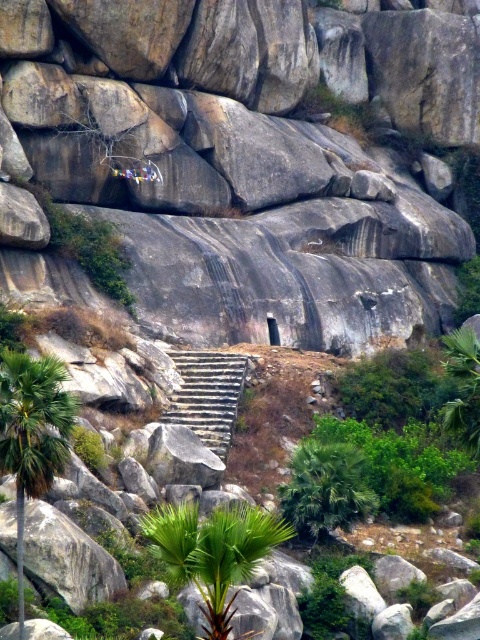
Question: Is green leafy palm at lower center behind green leafy palm tree at lower left?

Choices:
 (A) yes
 (B) no

Answer: (B)

Question: Observing the image, what is the correct spatial positioning of green leafy palm at center in reference to gray stone stairs at center?

Choices:
 (A) below
 (B) above

Answer: (A)

Question: Is green leafy palm tree at lower left bigger than gray stone stairs at center?

Choices:
 (A) yes
 (B) no

Answer: (B)

Question: Which of these objects is positioned closest to the green leafy palm at lower center?

Choices:
 (A) gray stone stairs at center
 (B) green leafy palm tree at lower left
 (C) green leafy palm at center

Answer: (B)

Question: Which object appears farthest from the camera in this image?

Choices:
 (A) green leafy palm at center
 (B) gray stone stairs at center

Answer: (B)

Question: Which object is farther from the camera taking this photo?

Choices:
 (A) green leafy palm tree at lower left
 (B) gray stone stairs at center
 (C) green leafy palm at lower center
 (D) green leafy palm at center

Answer: (B)